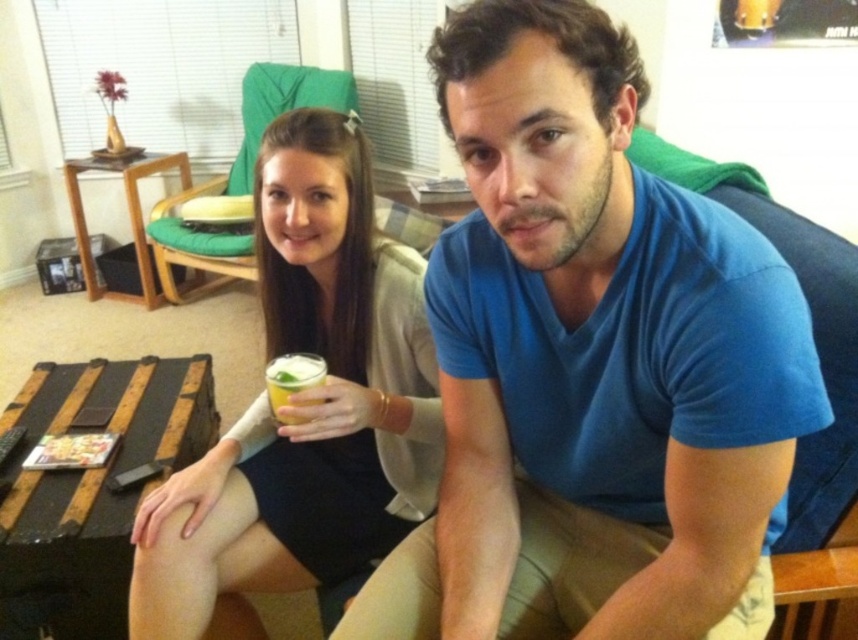
Looking at this image, you are a photographer setting up for a portrait. You notice the matte black dress at center and the translucent plastic cup at center in the frame. Based on their positions, which object is taller?

The matte black dress at center is taller than the translucent plastic cup at center.

You are a photographer setting up for a portrait session in this living room. You need to ensure the blue cotton shirt at center and the matte black dress at center are visible in the shot. Which one should you position closer to the camera to avoid being blocked by the other?

The blue cotton shirt at center is on the right side of the matte black dress at center. To prevent the matte black dress at center from blocking the blue cotton shirt at center, position the blue cotton shirt at center closer to the camera.